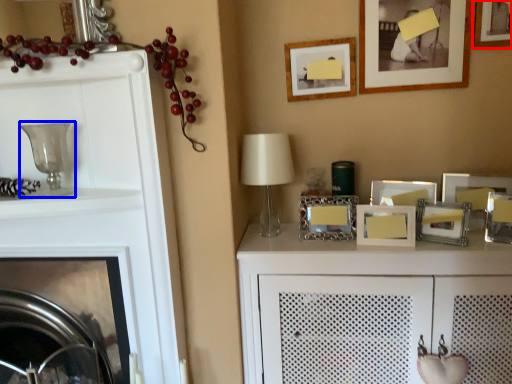
Question: Which point is closer to the camera, picture frame (highlighted by a red box) or candle holder (highlighted by a blue box)?

Choices:
 (A) picture frame
 (B) candle holder

Answer: (B)